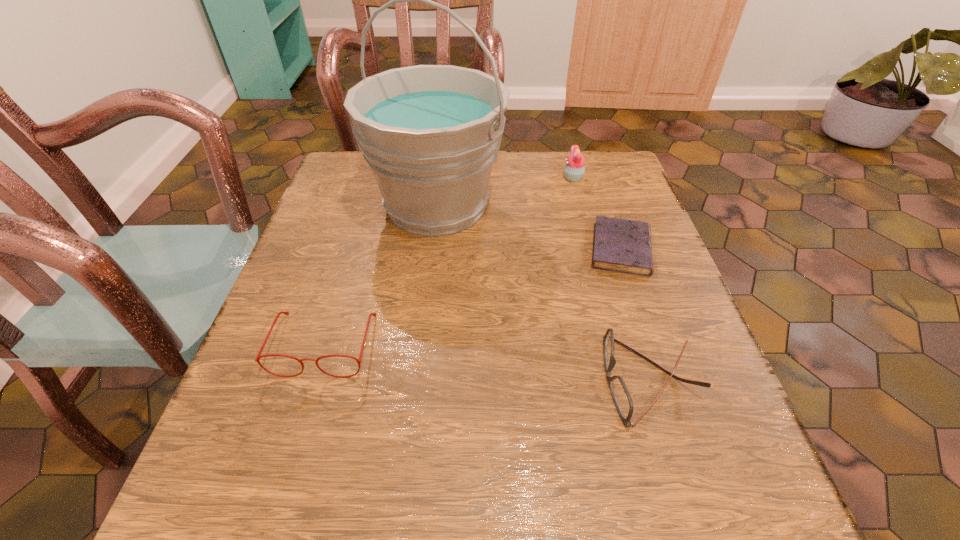
Where is `the tallest object`? the tallest object is located at coordinates (430, 134).

Where is `the fourth shortest object`? the fourth shortest object is located at coordinates (574, 169).

You are a GUI agent. You are given a task and a screenshot of the screen. Output one action in this format:
    pyautogui.click(x=<x>, y=<y>)
    Task: Click on the taller spectacles
    The height and width of the screenshot is (540, 960).
    Given the screenshot: What is the action you would take?
    pyautogui.click(x=258, y=356)

Find the location of a particular element. The width and height of the screenshot is (960, 540). the third shortest object is located at coordinates (258, 356).

Find the location of a particular element. The height and width of the screenshot is (540, 960). the shorter spectacles is located at coordinates (620, 393).

This screenshot has height=540, width=960. Find the location of `the fourth tallest object`. the fourth tallest object is located at coordinates (620, 393).

This screenshot has height=540, width=960. In order to click on diary in this screenshot , I will do `click(619, 245)`.

Where is `vacant space located on the back of the bucket`? The image size is (960, 540). vacant space located on the back of the bucket is located at coordinates (444, 154).

You are a GUI agent. You are given a task and a screenshot of the screen. Output one action in this format:
    pyautogui.click(x=<x>, y=<y>)
    Task: Click on the vacant region located on the face of the fourth shortest object
    This screenshot has width=960, height=540.
    Given the screenshot: What is the action you would take?
    pyautogui.click(x=501, y=178)

The image size is (960, 540). I want to click on vacant region located on the face of the fourth shortest object, so click(466, 178).